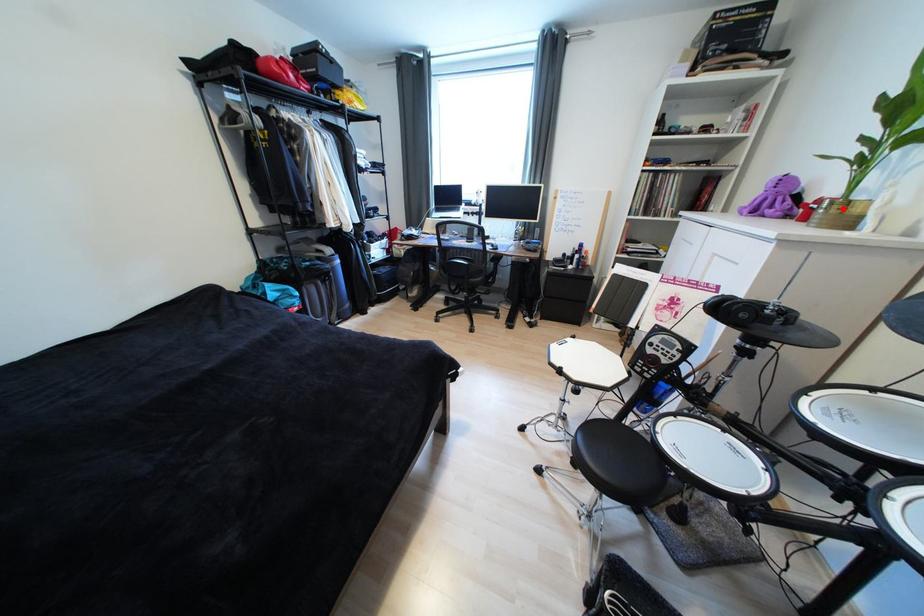
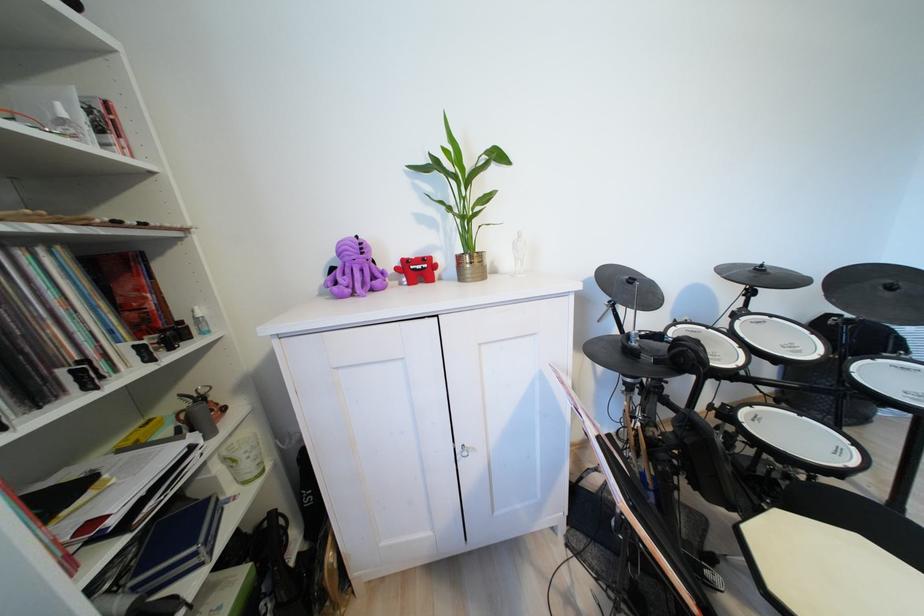
In the second image, find the point that corresponds to the highlighted location in the first image.

(482, 262)